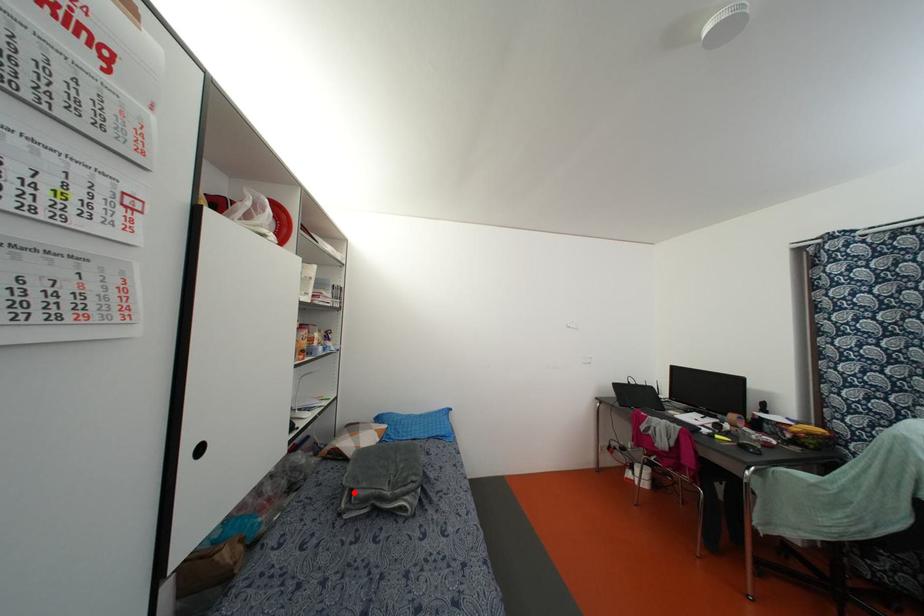
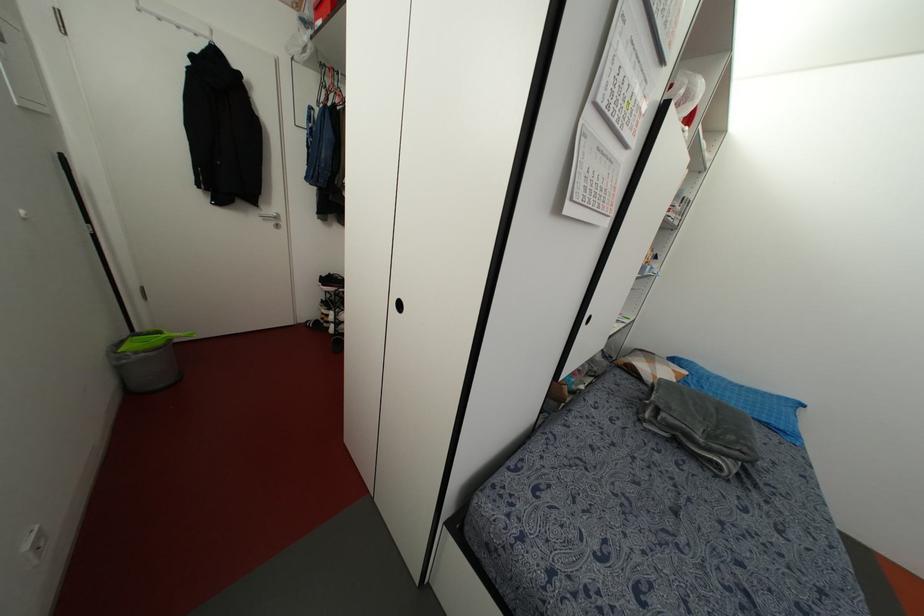
Question: I am providing you with two images of the same scene from different viewpoints. Given a red point in image1, look at the same physical point in image2. Is it:

Choices:
 (A) Closer to the viewpoint
 (B) Farther from the viewpoint

Answer: (A)